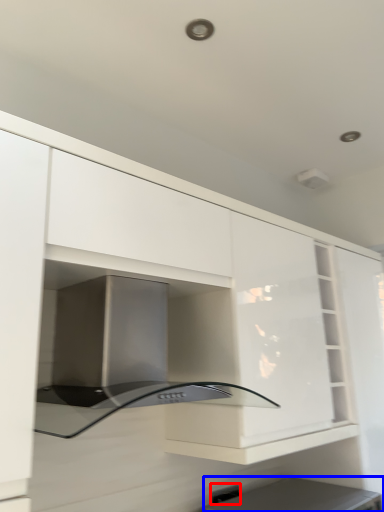
Question: Which of the following is the farthest to the observer, electric outlet (highlighted by a red box) or appliance (highlighted by a blue box)?

Choices:
 (A) electric outlet
 (B) appliance

Answer: (A)